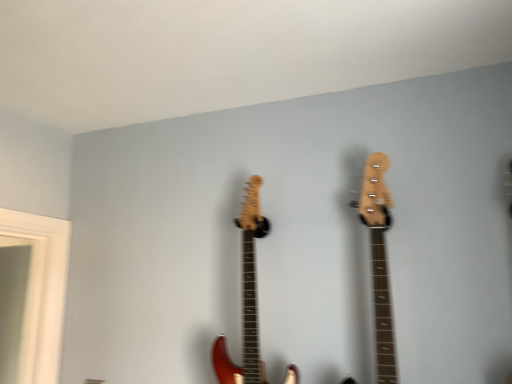
Question: Should I look upward or downward to see shiny red electric guitar at center?

Choices:
 (A) down
 (B) up

Answer: (A)